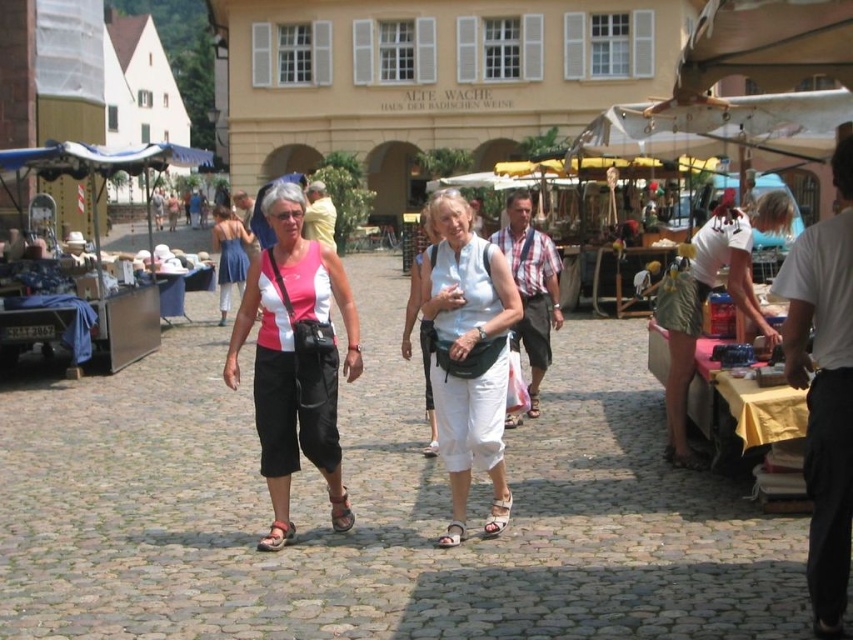
Question: Can you confirm if white leather sandal at center is positioned above brown leather sandal at lower center?

Choices:
 (A) no
 (B) yes

Answer: (B)

Question: Which of the following is the closest to the observer?

Choices:
 (A) white cotton pants at center
 (B) white leather sandal at center
 (C) pink fabric dress at center

Answer: (A)

Question: Can you confirm if pink fabric top at center is smaller than white cotton pants at center?

Choices:
 (A) no
 (B) yes

Answer: (A)

Question: Can you confirm if brown leather sandal at center is thinner than white leather sandal at center?

Choices:
 (A) yes
 (B) no

Answer: (A)

Question: Which object is positioned closest to the brown leather sandal at lower center?

Choices:
 (A) white leather sandal at center
 (B) brown leather sandal at center
 (C) leather sandal at center

Answer: (B)

Question: Which point appears farthest from the camera in this image?

Choices:
 (A) (459, 531)
 (B) (271, 532)

Answer: (B)